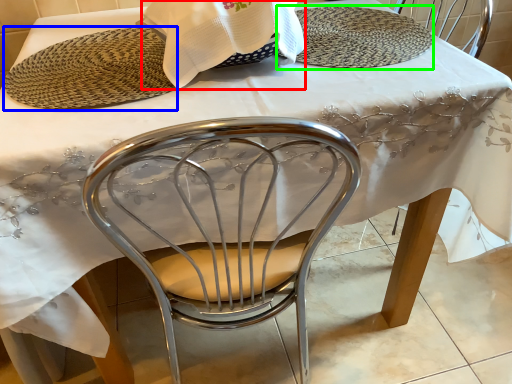
Question: Which object is positioned closest to blanket (highlighted by a red box)? Select from platter (highlighted by a blue box) and plate (highlighted by a green box).

Choices:
 (A) platter
 (B) plate

Answer: (A)